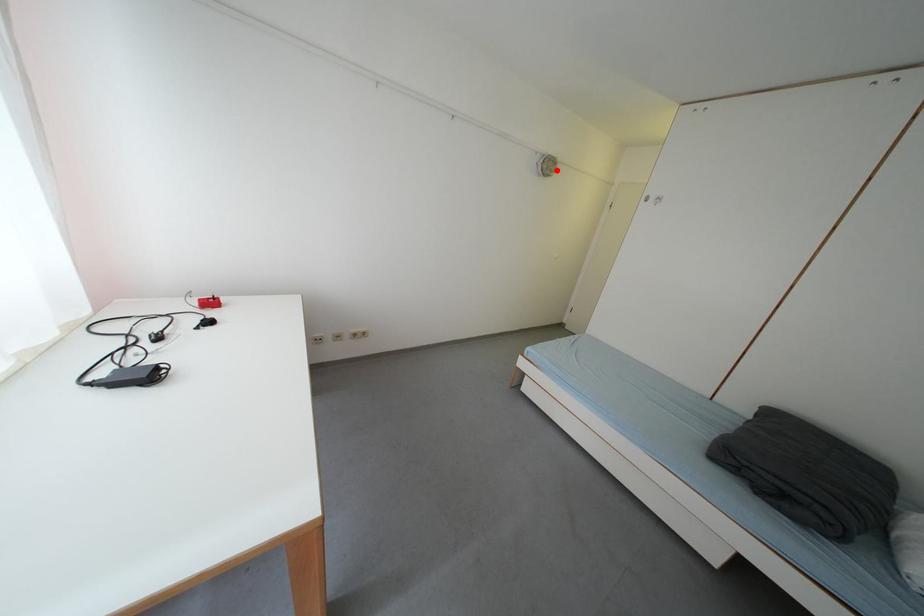
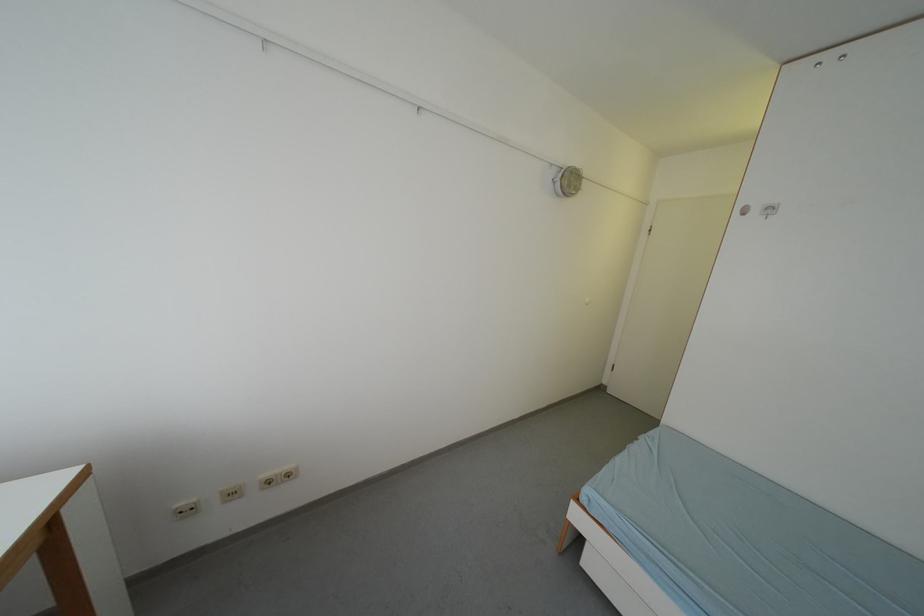
Find the pixel in the second image that matches the highlighted location in the first image.

(578, 185)